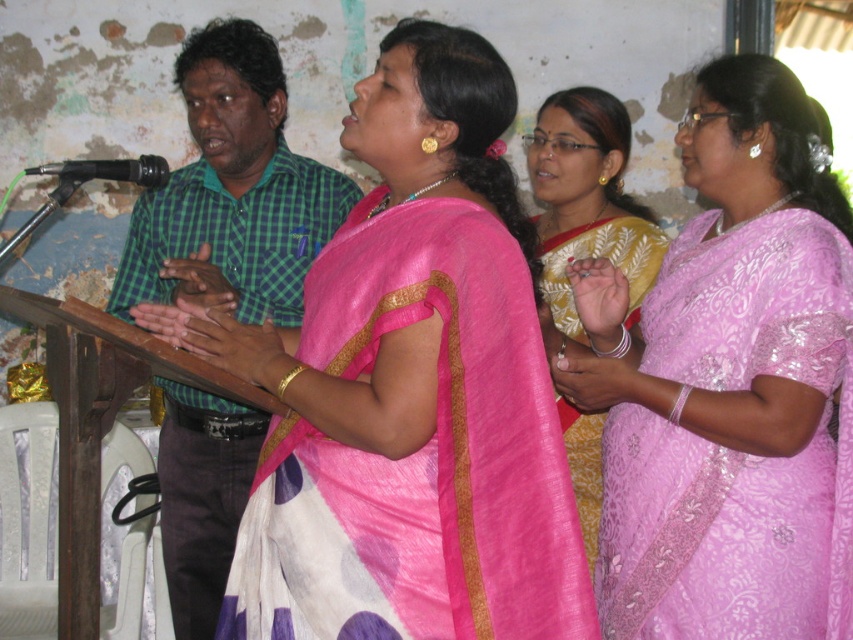
Based on the scene description, can you determine the spatial relationship between the yellow silk saree at center and the black matte microphone at left?

The yellow silk saree at center is located to the right of the black matte microphone at left.